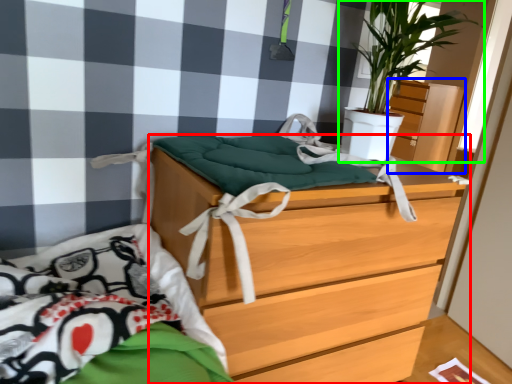
Question: Estimate the real-world distances between objects in this image. Which object is closer to chest of drawers (highlighted by a red box), dresser (highlighted by a blue box) or houseplant (highlighted by a green box)?

Choices:
 (A) dresser
 (B) houseplant

Answer: (B)